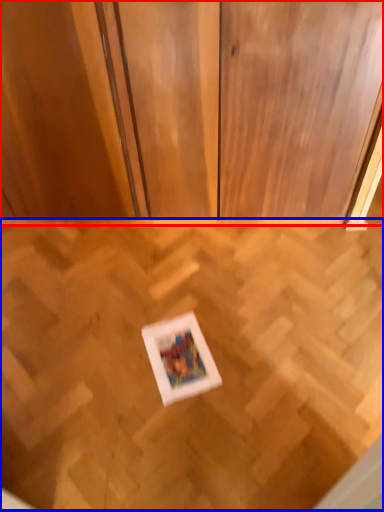
Question: Which object is further to the camera taking this photo, dresser (highlighted by a red box) or plywood (highlighted by a blue box)?

Choices:
 (A) dresser
 (B) plywood

Answer: (A)